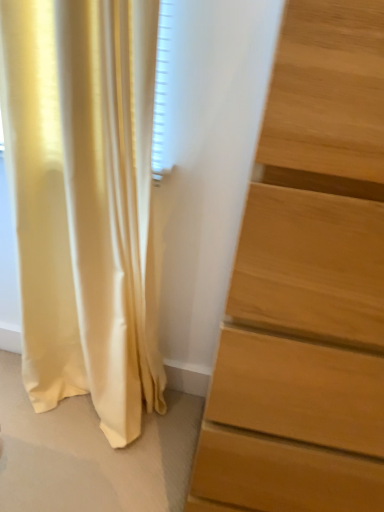
The width and height of the screenshot is (384, 512). I want to click on light brown wooden chest of drawers at right, so click(307, 284).

The width and height of the screenshot is (384, 512). Describe the element at coordinates (307, 284) in the screenshot. I see `light brown wooden chest of drawers at right` at that location.

The width and height of the screenshot is (384, 512). What do you see at coordinates (84, 200) in the screenshot?
I see `satin yellow curtain at left` at bounding box center [84, 200].

You are a GUI agent. You are given a task and a screenshot of the screen. Output one action in this format:
    pyautogui.click(x=<x>, y=<y>)
    Task: Click on the satin yellow curtain at left
    
    Given the screenshot: What is the action you would take?
    pyautogui.click(x=84, y=200)

You are a GUI agent. You are given a task and a screenshot of the screen. Output one action in this format:
    pyautogui.click(x=<x>, y=<y>)
    Task: Click on the light brown wooden chest of drawers at right
    This screenshot has height=512, width=384.
    Given the screenshot: What is the action you would take?
    pyautogui.click(x=307, y=284)

Visually, is satin yellow curtain at left positioned to the left or to the right of light brown wooden chest of drawers at right?

Based on their positions, satin yellow curtain at left is located to the left of light brown wooden chest of drawers at right.

Which object is closer to the camera taking this photo, satin yellow curtain at left or light brown wooden chest of drawers at right?

light brown wooden chest of drawers at right is in front.

Considering the positions of points (139, 284) and (371, 369), is point (139, 284) farther from camera compared to point (371, 369)?

Yes, point (139, 284) is farther from viewer.

From the image's perspective, is satin yellow curtain at left positioned above or below light brown wooden chest of drawers at right?

satin yellow curtain at left is situated higher than light brown wooden chest of drawers at right in the image.

From a real-world perspective, relative to light brown wooden chest of drawers at right, is satin yellow curtain at left vertically above or below?

satin yellow curtain at left is below light brown wooden chest of drawers at right.

Considering the sizes of objects satin yellow curtain at left and light brown wooden chest of drawers at right in the image provided, who is thinner, satin yellow curtain at left or light brown wooden chest of drawers at right?

satin yellow curtain at left is thinner.

Based on the photo, considering the sizes of objects satin yellow curtain at left and light brown wooden chest of drawers at right in the image provided, who is taller, satin yellow curtain at left or light brown wooden chest of drawers at right?

light brown wooden chest of drawers at right.

Considering the relative sizes of satin yellow curtain at left and light brown wooden chest of drawers at right in the image provided, is satin yellow curtain at left bigger than light brown wooden chest of drawers at right?

No, satin yellow curtain at left is not bigger than light brown wooden chest of drawers at right.

Based on the photo, is satin yellow curtain at left spatially inside light brown wooden chest of drawers at right, or outside of it?

satin yellow curtain at left exists outside the volume of light brown wooden chest of drawers at right.

Are satin yellow curtain at left and light brown wooden chest of drawers at right beside each other?

No, satin yellow curtain at left is not beside light brown wooden chest of drawers at right.

Does satin yellow curtain at left turn towards light brown wooden chest of drawers at right?

No, satin yellow curtain at left is not turned towards light brown wooden chest of drawers at right.

Consider the image. Can you tell me how much satin yellow curtain at left and light brown wooden chest of drawers at right differ in facing direction?

satin yellow curtain at left and light brown wooden chest of drawers at right are facing 0.000223 degrees away from each other.

The image size is (384, 512). I want to click on curtain beneath the light brown wooden chest of drawers at right (from a real-world perspective), so click(x=84, y=200).

Does light brown wooden chest of drawers at right appear on the right side of satin yellow curtain at left?

Yes, light brown wooden chest of drawers at right is to the right of satin yellow curtain at left.

Does light brown wooden chest of drawers at right lie in front of satin yellow curtain at left?

Yes, light brown wooden chest of drawers at right is closer to the camera.

Which is in front, point (319, 222) or point (79, 376)?

Positioned in front is point (319, 222).

From the image's perspective, would you say light brown wooden chest of drawers at right is shown under satin yellow curtain at left?

Indeed, from the image's perspective, light brown wooden chest of drawers at right is shown beneath satin yellow curtain at left.

From a real-world perspective, relative to satin yellow curtain at left, is light brown wooden chest of drawers at right vertically above or below?

light brown wooden chest of drawers at right is above satin yellow curtain at left.

Does light brown wooden chest of drawers at right have a greater width compared to satin yellow curtain at left?

Yes.

Based on the photo, considering the relative sizes of light brown wooden chest of drawers at right and satin yellow curtain at left in the image provided, is light brown wooden chest of drawers at right taller than satin yellow curtain at left?

Yes, light brown wooden chest of drawers at right is taller than satin yellow curtain at left.

Which of these two, light brown wooden chest of drawers at right or satin yellow curtain at left, is smaller?

Smaller between the two is satin yellow curtain at left.

Would you say satin yellow curtain at left is part of light brown wooden chest of drawers at right's contents?

No, satin yellow curtain at left is not inside light brown wooden chest of drawers at right.

Is light brown wooden chest of drawers at right touching satin yellow curtain at left?

No.

Does light brown wooden chest of drawers at right turn towards satin yellow curtain at left?

No.

The image size is (384, 512). Find the location of `chest of drawers below the satin yellow curtain at left (from the image's perspective)`. chest of drawers below the satin yellow curtain at left (from the image's perspective) is located at coordinates (307, 284).

I want to click on chest of drawers in front of the satin yellow curtain at left, so click(x=307, y=284).

This screenshot has height=512, width=384. Identify the location of the chest of drawers located above the satin yellow curtain at left (from a real-world perspective). (307, 284).